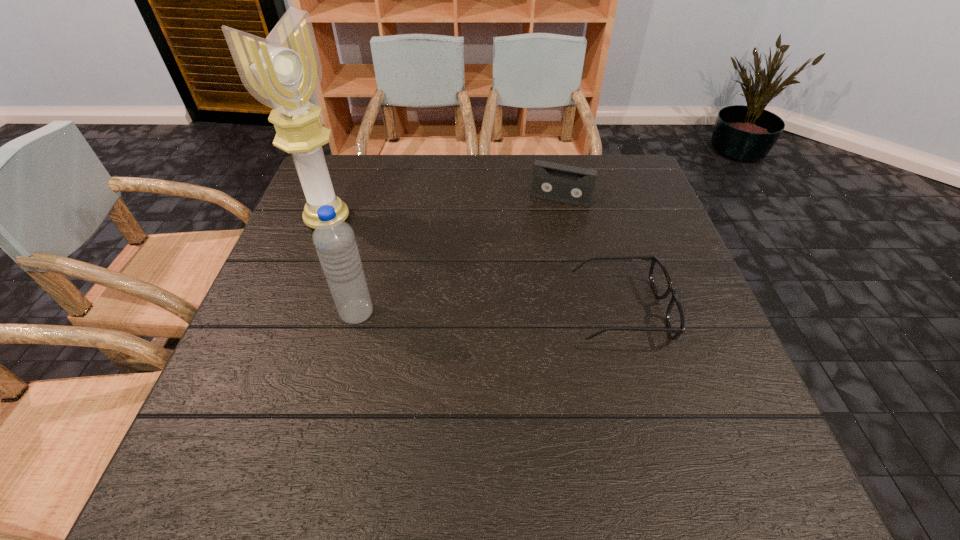
In order to click on blank area located on the front-facing side of the award in this screenshot , I will do `click(357, 239)`.

The height and width of the screenshot is (540, 960). I want to click on vacant space located 0.270m on the front-facing side of the award, so click(x=422, y=278).

In order to click on vacant point located 0.060m on the front-facing side of the award in this screenshot , I will do `click(360, 241)`.

Image resolution: width=960 pixels, height=540 pixels. I want to click on object located at the far edge, so click(x=553, y=181).

Where is `object situated at the left edge`? object situated at the left edge is located at coordinates (284, 72).

This screenshot has width=960, height=540. I want to click on object that is at the right edge, so tap(660, 280).

Image resolution: width=960 pixels, height=540 pixels. Find the location of `free space at the far edge of the desktop`. free space at the far edge of the desktop is located at coordinates (385, 190).

Locate an element on the screen. blank area at the near edge is located at coordinates (508, 416).

This screenshot has height=540, width=960. I want to click on free region at the left edge of the desktop, so click(x=256, y=348).

Where is `vacant area at the right edge of the desktop`? The width and height of the screenshot is (960, 540). vacant area at the right edge of the desktop is located at coordinates (622, 205).